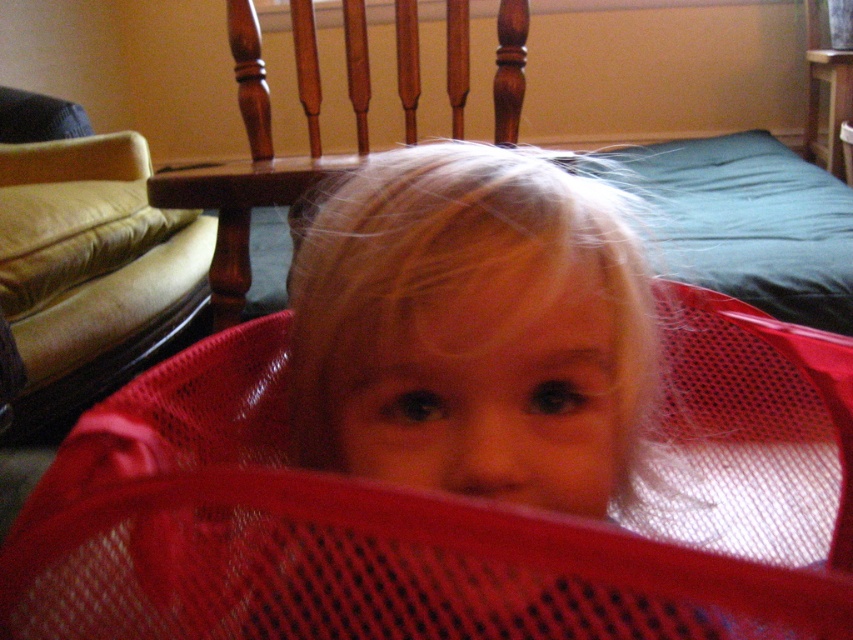
Question: In this image, where is red mesh basket at center located relative to wooden chair at center?

Choices:
 (A) below
 (B) above

Answer: (A)

Question: Estimate the real-world distances between objects in this image. Which object is farther from the red mesh basket at center?

Choices:
 (A) beige fabric couch at left
 (B) matte plastic basket at center

Answer: (A)

Question: Which point is farther to the camera?

Choices:
 (A) matte plastic basket at center
 (B) wooden chair at center
 (C) beige fabric couch at left
 (D) red mesh basket at center

Answer: (C)

Question: Is red mesh basket at center smaller than matte plastic basket at center?

Choices:
 (A) no
 (B) yes

Answer: (A)

Question: Is red mesh basket at center positioned at the back of wooden chair at center?

Choices:
 (A) no
 (B) yes

Answer: (A)

Question: Which point is closer to the camera?

Choices:
 (A) (448, 596)
 (B) (216, 252)

Answer: (A)